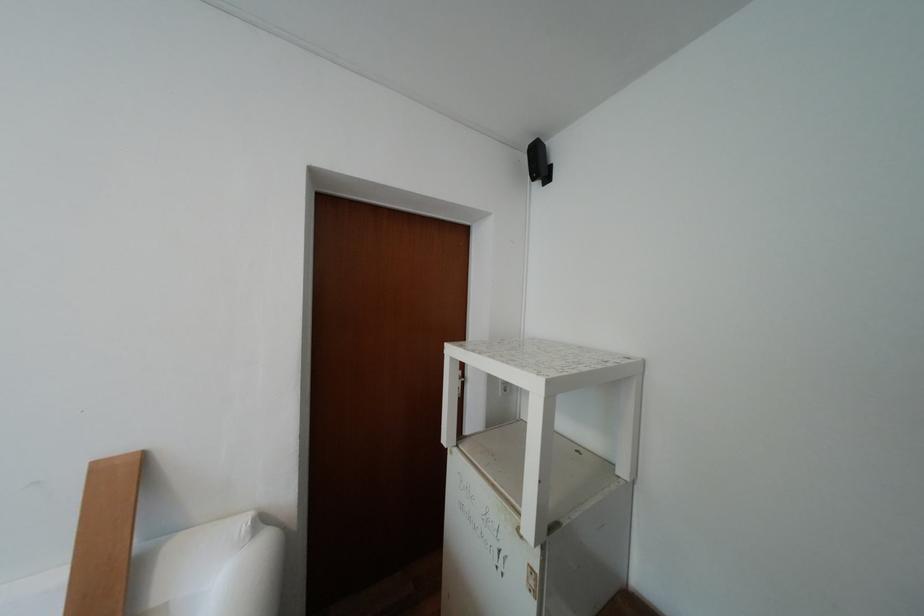
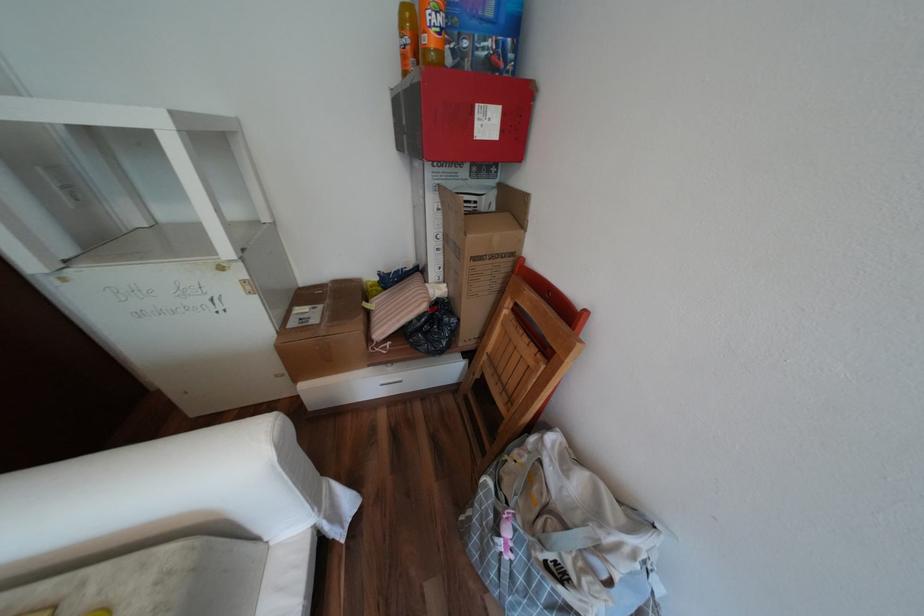
Based on the continuous images, in which direction is the camera rotating?

The camera rotated toward right-down.